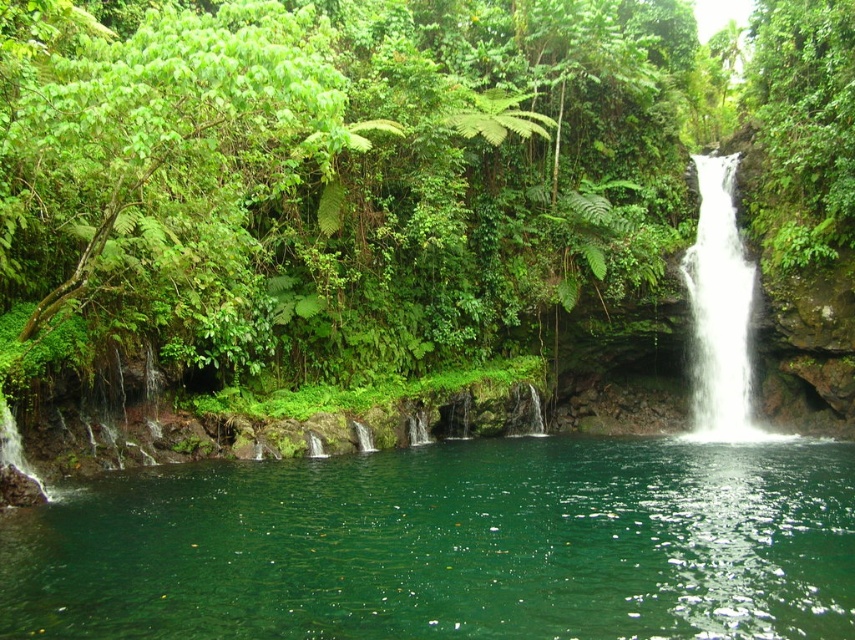
You are a hiker who wants to cross the green translucent water at center to reach the white smooth waterfall at right. Is the path safe to walk on?

The green translucent water at center is below the white smooth waterfall at right, so the path might be slippery and unsafe due to the flowing water from the waterfall.

You are a hiker standing at the edge of the green translucent water at center and looking towards the green leafy foliage at upper center. Which object is closer to you?

The green leafy foliage at upper center is closer to you because it is further to the viewer than the green translucent water at center.

In the scene shown: You are standing at the edge of the green pool and want to reach the white smooth waterfall at right. Which direction should you walk to avoid the green leafy foliage at upper center?

The green leafy foliage at upper center is above the white smooth waterfall at right, so to avoid it, you should walk to the left side of the waterfall.